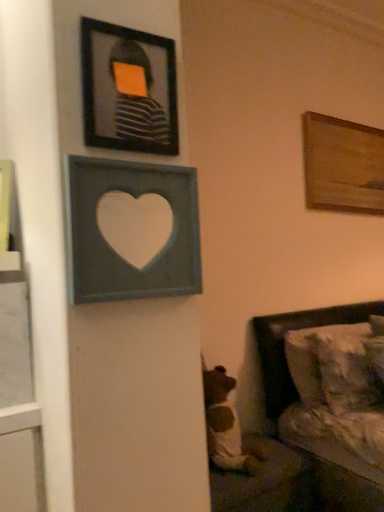
Identify the location of wooden painting at upper right, which appears as the first picture frame when viewed from the right. This screenshot has width=384, height=512. (342, 165).

How much space does matte black frame at upper left, positioned as the 2th picture frame in front-to-back order, occupy horizontally?

matte black frame at upper left, positioned as the 2th picture frame in front-to-back order, is 1.26 inches wide.

Describe the element at coordinates (128, 89) in the screenshot. I see `matte black frame at upper left, positioned as the 2th picture frame in front-to-back order` at that location.

Image resolution: width=384 pixels, height=512 pixels. I want to click on white textured pillow at lower right, so click(x=312, y=358).

The height and width of the screenshot is (512, 384). What are the coordinates of `brown plush bear at lower center` in the screenshot? It's located at (225, 425).

I want to click on wooden painting at upper right, which is counted as the 3th picture frame, starting from the front, so click(x=342, y=165).

From the image's perspective, is brown plush bear at lower center on top of gray wood heart at upper center, the third picture frame from the back?

No, from the image's perspective, brown plush bear at lower center is not above gray wood heart at upper center, the third picture frame from the back.

Is there a large distance between brown plush bear at lower center and gray wood heart at upper center, the third picture frame from the back?

Yes.

From the picture: Considering the relative sizes of brown plush bear at lower center and gray wood heart at upper center, which appears as the first picture frame when viewed from the front, in the image provided, is brown plush bear at lower center bigger than gray wood heart at upper center, which appears as the first picture frame when viewed from the front,?

Yes.

Is gray wood heart at upper center, the third picture frame from the back, inside wooden painting at upper right, which is counted as the 3th picture frame, starting from the front?

No, gray wood heart at upper center, the third picture frame from the back, is located outside of wooden painting at upper right, which is counted as the 3th picture frame, starting from the front.

This screenshot has width=384, height=512. In order to click on picture frame that is on the right side of gray wood heart at upper center, which appears as the first picture frame when viewed from the front in this screenshot , I will do `click(342, 165)`.

Which object is positioned more to the left, wooden painting at upper right, the 1th picture frame viewed from the back, or gray wood heart at upper center, placed as the 2th picture frame when sorted from right to left?

Positioned to the left is gray wood heart at upper center, placed as the 2th picture frame when sorted from right to left.

Is wooden painting at upper right, the third picture frame from the left, further to camera compared to gray wood heart at upper center, placed as the 2th picture frame when sorted from right to left?

Yes, the depth of wooden painting at upper right, the third picture frame from the left, is greater than that of gray wood heart at upper center, placed as the 2th picture frame when sorted from right to left.

Who is smaller, matte black frame at upper left, which is counted as the 3th picture frame, starting from the right, or gray wood heart at upper center, the second picture frame viewed from the left?

matte black frame at upper left, which is counted as the 3th picture frame, starting from the right, is smaller.

In the image, is matte black frame at upper left, arranged as the first picture frame when viewed from the left, positioned in front of or behind gray wood heart at upper center, the second picture frame viewed from the left?

Visually, matte black frame at upper left, arranged as the first picture frame when viewed from the left, is located behind gray wood heart at upper center, the second picture frame viewed from the left.

Considering the positions of objects matte black frame at upper left, arranged as the first picture frame when viewed from the left, and gray wood heart at upper center, which appears as the first picture frame when viewed from the front, in the image provided, who is more to the left, matte black frame at upper left, arranged as the first picture frame when viewed from the left, or gray wood heart at upper center, which appears as the first picture frame when viewed from the front,?

From the viewer's perspective, matte black frame at upper left, arranged as the first picture frame when viewed from the left, appears more on the left side.

Is gray wood heart at upper center, which appears as the first picture frame when viewed from the front, not near white textured pillow at lower right?

Yes.

Who is taller, gray wood heart at upper center, placed as the 2th picture frame when sorted from right to left, or white textured pillow at lower right?

white textured pillow at lower right is taller.

Is gray wood heart at upper center, placed as the 2th picture frame when sorted from right to left, facing towards white textured pillow at lower right?

No, gray wood heart at upper center, placed as the 2th picture frame when sorted from right to left, is not aimed at white textured pillow at lower right.

Measure the distance from gray wood heart at upper center, the third picture frame from the back, to white textured pillow at lower right.

gray wood heart at upper center, the third picture frame from the back, and white textured pillow at lower right are 4.17 feet apart.

Considering the relative sizes of gray wood heart at upper center, the second picture frame viewed from the left, and matte black frame at upper left, arranged as the first picture frame when viewed from the left, in the image provided, is gray wood heart at upper center, the second picture frame viewed from the left, shorter than matte black frame at upper left, arranged as the first picture frame when viewed from the left,?

Incorrect, the height of gray wood heart at upper center, the second picture frame viewed from the left, does not fall short of that of matte black frame at upper left, arranged as the first picture frame when viewed from the left.

Between point (183, 198) and point (113, 132), which one is positioned behind?

The point (183, 198) is farther from the camera.

Considering the sizes of gray wood heart at upper center, the second picture frame viewed from the left, and matte black frame at upper left, acting as the second picture frame starting from the back, in the image, is gray wood heart at upper center, the second picture frame viewed from the left, bigger or smaller than matte black frame at upper left, acting as the second picture frame starting from the back,?

Considering their sizes, gray wood heart at upper center, the second picture frame viewed from the left, takes up more space than matte black frame at upper left, acting as the second picture frame starting from the back.

Can you confirm if brown plush bear at lower center is thinner than wooden painting at upper right, which appears as the first picture frame when viewed from the right?

In fact, brown plush bear at lower center might be wider than wooden painting at upper right, which appears as the first picture frame when viewed from the right.

Who is bigger, brown plush bear at lower center or wooden painting at upper right, which is counted as the 3th picture frame, starting from the front?

brown plush bear at lower center is bigger.

How far apart are brown plush bear at lower center and wooden painting at upper right, the 1th picture frame viewed from the back?

The distance of brown plush bear at lower center from wooden painting at upper right, the 1th picture frame viewed from the back, is 4.71 feet.

How different are the orientations of brown plush bear at lower center and wooden painting at upper right, which appears as the first picture frame when viewed from the right, in degrees?

The angular difference between brown plush bear at lower center and wooden painting at upper right, which appears as the first picture frame when viewed from the right, is 37.3 degrees.

Can you confirm if matte black frame at upper left, positioned as the 2th picture frame in front-to-back order, is thinner than wooden painting at upper right, which appears as the first picture frame when viewed from the right?

Correct, the width of matte black frame at upper left, positioned as the 2th picture frame in front-to-back order, is less than that of wooden painting at upper right, which appears as the first picture frame when viewed from the right.

Locate an element on the screen. The image size is (384, 512). picture frame that is the 1st one when counting downward from the wooden painting at upper right, the third picture frame from the left (from the image's perspective) is located at coordinates (128, 89).

Looking at the image, does matte black frame at upper left, positioned as the 2th picture frame in front-to-back order, seem bigger or smaller compared to wooden painting at upper right, which appears as the first picture frame when viewed from the right?

In the image, matte black frame at upper left, positioned as the 2th picture frame in front-to-back order, appears to be smaller than wooden painting at upper right, which appears as the first picture frame when viewed from the right.

How far apart are matte black frame at upper left, arranged as the first picture frame when viewed from the left, and wooden painting at upper right, the 1th picture frame viewed from the back?

A distance of 1.81 meters exists between matte black frame at upper left, arranged as the first picture frame when viewed from the left, and wooden painting at upper right, the 1th picture frame viewed from the back.

From the image's perspective, count 1st picture frames upward from the brown plush bear at lower center and point to it. Please provide its 2D coordinates.

[(113, 249)]

Locate an element on the screen. This screenshot has height=512, width=384. the 1st picture frame counting from the left of the wooden painting at upper right, which is counted as the 3th picture frame, starting from the front is located at coordinates (113, 249).

From the image, which object appears to be farther from white textured pillow at lower right, gray wood heart at upper center, which appears as the first picture frame when viewed from the front, or wooden painting at upper right, which appears as the first picture frame when viewed from the right?

gray wood heart at upper center, which appears as the first picture frame when viewed from the front, is positioned further to the anchor white textured pillow at lower right.

Which object lies further to the anchor point wooden painting at upper right, which is counted as the 3th picture frame, starting from the front, gray wood heart at upper center, placed as the 2th picture frame when sorted from right to left, or brown plush bear at lower center?

gray wood heart at upper center, placed as the 2th picture frame when sorted from right to left, lies further to wooden painting at upper right, which is counted as the 3th picture frame, starting from the front, than the other object.

Considering their positions, is gray wood heart at upper center, placed as the 2th picture frame when sorted from right to left, positioned further to white textured pillow at lower right than brown plush bear at lower center?

The object further to white textured pillow at lower right is gray wood heart at upper center, placed as the 2th picture frame when sorted from right to left.

Looking at the image, which one is located closer to white textured pillow at lower right, brown plush bear at lower center or matte black frame at upper left, acting as the second picture frame starting from the back?

Among the two, brown plush bear at lower center is located nearer to white textured pillow at lower right.

Considering their positions, is white textured pillow at lower right positioned closer to matte black frame at upper left, acting as the second picture frame starting from the back, than gray wood heart at upper center, which appears as the first picture frame when viewed from the front?

The object closer to matte black frame at upper left, acting as the second picture frame starting from the back, is gray wood heart at upper center, which appears as the first picture frame when viewed from the front.

Looking at the image, which one is located closer to white textured pillow at lower right, wooden painting at upper right, which appears as the first picture frame when viewed from the right, or gray wood heart at upper center, placed as the 2th picture frame when sorted from right to left?

wooden painting at upper right, which appears as the first picture frame when viewed from the right, lies closer to white textured pillow at lower right than the other object.

From the image, which object appears to be nearer to white textured pillow at lower right, brown plush bear at lower center or wooden painting at upper right, the 1th picture frame viewed from the back?

Based on the image, brown plush bear at lower center appears to be nearer to white textured pillow at lower right.

From the image, which object appears to be nearer to wooden painting at upper right, the 1th picture frame viewed from the back, matte black frame at upper left, positioned as the 2th picture frame in front-to-back order, or brown plush bear at lower center?

brown plush bear at lower center is positioned closer to the anchor wooden painting at upper right, the 1th picture frame viewed from the back.

The width and height of the screenshot is (384, 512). Identify the location of picture frame between matte black frame at upper left, which is counted as the 3th picture frame, starting from the right, and brown plush bear at lower center in the up-down direction. (113, 249).

Locate an element on the screen. picture frame between gray wood heart at upper center, the third picture frame from the back, and wooden painting at upper right, the third picture frame from the left, along the z-axis is located at coordinates (128, 89).

The image size is (384, 512). I want to click on pillow between gray wood heart at upper center, the second picture frame viewed from the left, and wooden painting at upper right, which is counted as the 3th picture frame, starting from the front, from front to back, so click(312, 358).

Where is `pillow between matte black frame at upper left, which is counted as the 3th picture frame, starting from the right, and brown plush bear at lower center in the up-down direction`? The width and height of the screenshot is (384, 512). pillow between matte black frame at upper left, which is counted as the 3th picture frame, starting from the right, and brown plush bear at lower center in the up-down direction is located at coordinates (312, 358).